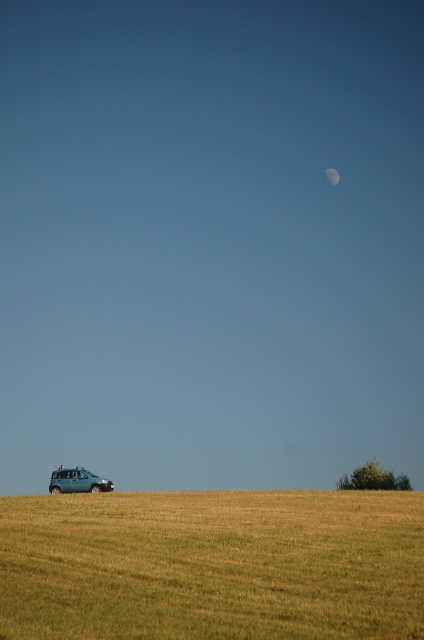
You are standing at the top of the slope in the field and see the golden dry grass at lower center and the teal matte car at lower left. Which object is closer to your current position?

The golden dry grass at lower center is closer to your current position because it is above the teal matte car at lower left, indicating it is situated higher up on the slope.